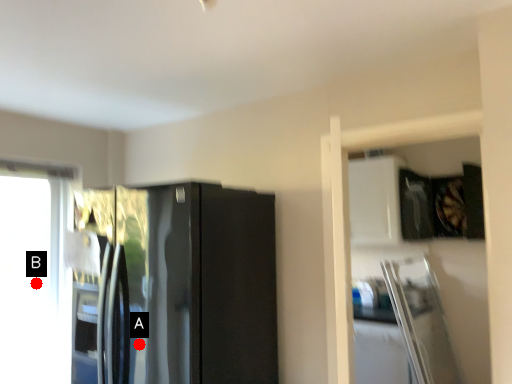
Question: Two points are circled on the image, labeled by A and B beside each circle. Which point is farther from the camera taking this photo?

Choices:
 (A) A is further
 (B) B is further

Answer: (B)